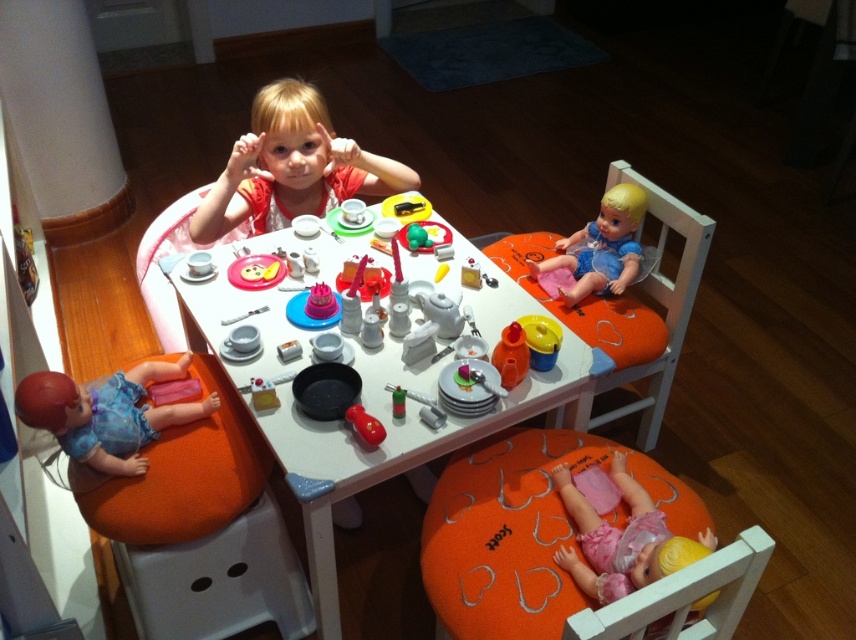
Question: Does matte plastic plate at center appear on the left side of rubberized plastic toy at center?

Choices:
 (A) yes
 (B) no

Answer: (A)

Question: Which of these objects is positioned closest to the matte plastic doll at lower left?

Choices:
 (A) smooth blonde hair at center
 (B) white plastic table at center
 (C) smooth plastic doll at upper right

Answer: (B)

Question: Can you confirm if white plastic table at center is smaller than matte plastic doll at lower left?

Choices:
 (A) no
 (B) yes

Answer: (A)

Question: Is smooth plastic doll at upper right bigger than rubberized plastic toy at center?

Choices:
 (A) yes
 (B) no

Answer: (A)

Question: Based on their relative distances, which object is nearer to the metallic silver fork at upper center?

Choices:
 (A) pink fabric doll at lower right
 (B) white plastic table at center
 (C) smooth plastic doll at upper right
 (D) white wood chair at upper right

Answer: (B)

Question: Which point appears farthest from the camera in this image?

Choices:
 (A) (256, 387)
 (B) (367, 419)
 (C) (584, 522)

Answer: (A)